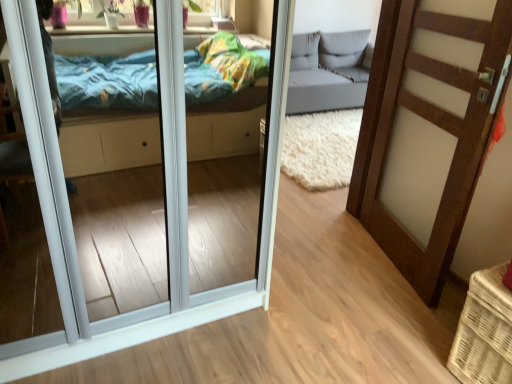
You are a GUI agent. You are given a task and a screenshot of the screen. Output one action in this format:
    pyautogui.click(x=<x>, y=<y>)
    Task: Click on the vacant space underneath brown wood door at right, which is the 2th door from left to right (from a real-world perspective)
    
    Given the screenshot: What is the action you would take?
    pyautogui.click(x=391, y=270)